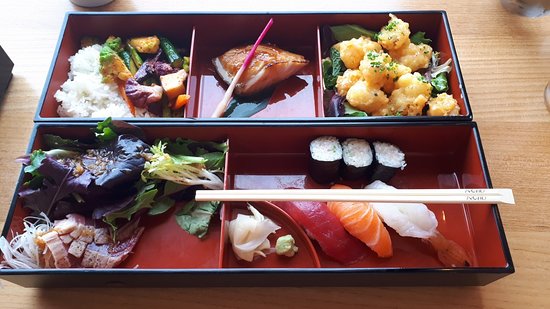
This screenshot has height=309, width=550. Identify the location of chop sticks. (455, 199).